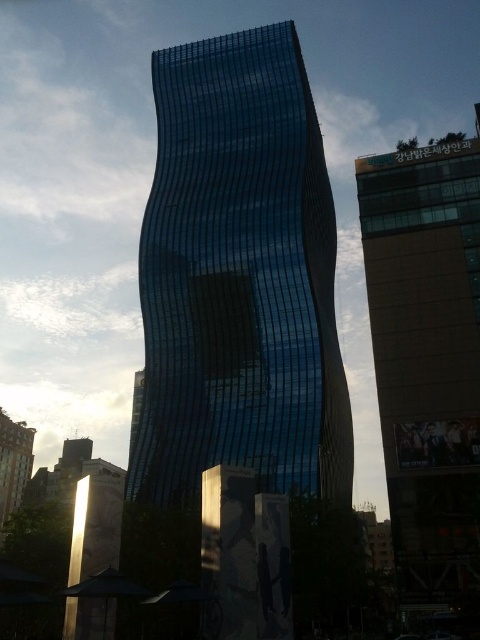
Does matte glass building at center have a greater height compared to matte glass building at lower left?

Correct, matte glass building at center is much taller as matte glass building at lower left.

Who is higher up, matte glass building at center or matte glass building at lower left?

matte glass building at center

Is point (377, 358) in front of point (24, 460)?

Yes.

The height and width of the screenshot is (640, 480). What are the coordinates of `matte glass building at center` in the screenshot? It's located at (427, 358).